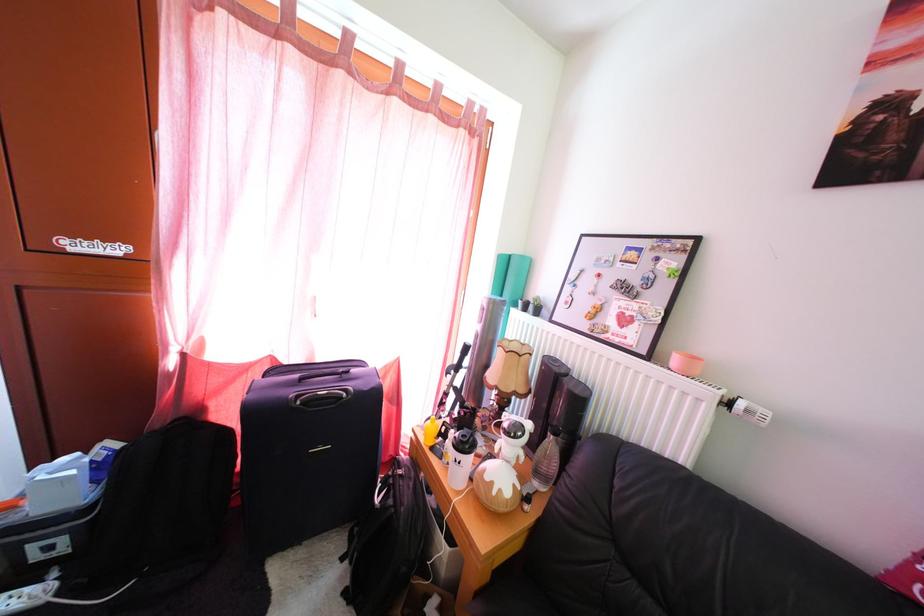
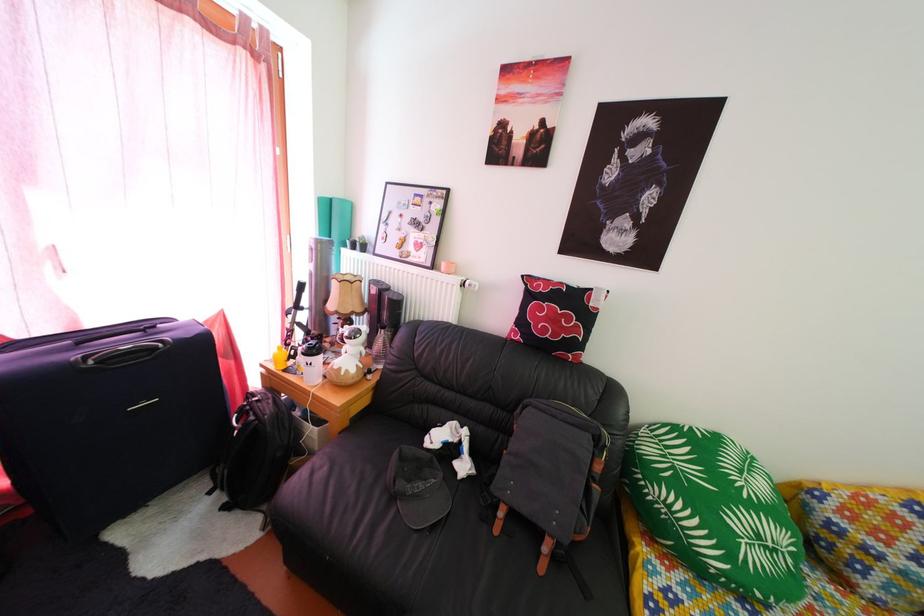
In the second image, find the point that corresponds to [472,455] in the first image.

(321, 360)